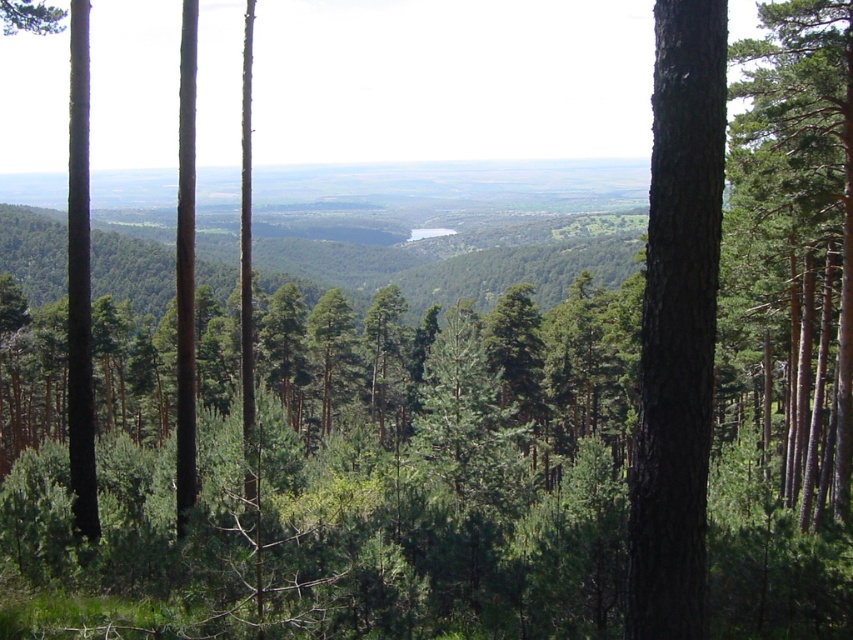
Question: Does brown rough bark tree at right have a smaller size compared to green matte tree at right?

Choices:
 (A) yes
 (B) no

Answer: (A)

Question: Among these objects, which one is nearest to the camera?

Choices:
 (A) green matte tree at right
 (B) brown rough bark tree at right

Answer: (B)

Question: Does brown rough bark tree at right appear on the left side of green matte tree at right?

Choices:
 (A) yes
 (B) no

Answer: (A)

Question: Which point is closer to the camera?

Choices:
 (A) (849, 26)
 (B) (689, 552)

Answer: (B)

Question: Can you confirm if brown rough bark tree at right is wider than green matte tree at right?

Choices:
 (A) no
 (B) yes

Answer: (A)